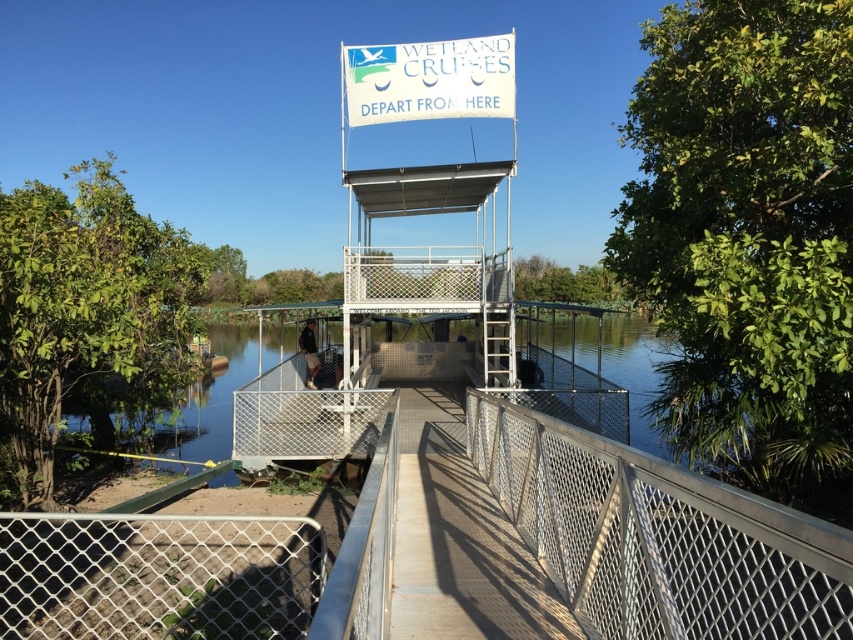
Is white mesh fence at center smaller than white metal observation tower at center?

Actually, white mesh fence at center might be larger than white metal observation tower at center.

Which is below, white mesh fence at center or white metal observation tower at center?

Positioned lower is white mesh fence at center.

Is point (299, 611) more distant than point (503, 312)?

No, it is in front of (503, 312).

The width and height of the screenshot is (853, 640). I want to click on white mesh fence at center, so click(x=158, y=577).